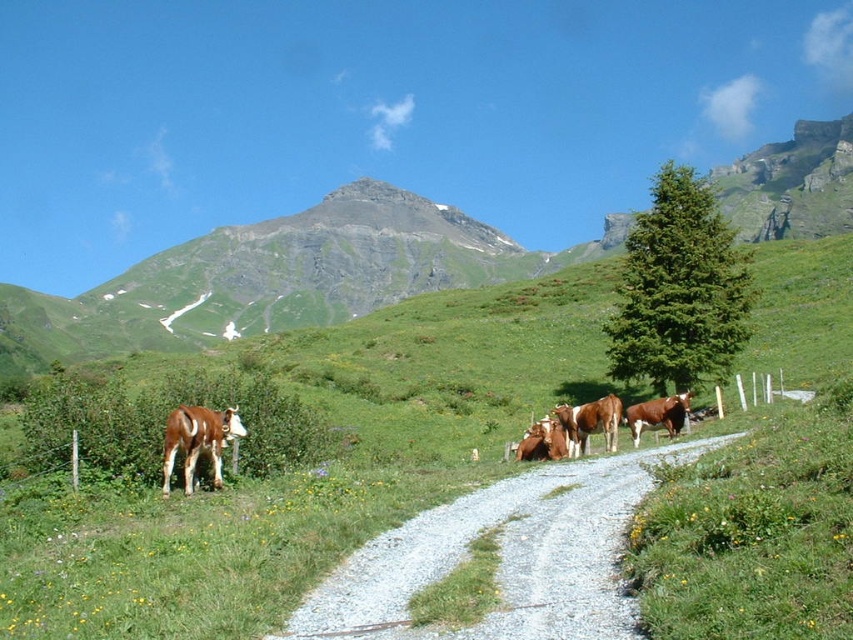
How far apart are gravel road at center and brown glossy cow at lower left?

gravel road at center and brown glossy cow at lower left are 14.34 meters apart.

Is point (434, 513) less distant than point (218, 472)?

That is True.

Is point (368, 580) in front of point (161, 470)?

That is True.

I want to click on gravel road at center, so click(x=502, y=556).

Is gravel road at center bigger than brown glossy cows at center?

No, gravel road at center is not bigger than brown glossy cows at center.

In the scene shown: Who is higher up, gravel road at center or brown glossy cows at center?

brown glossy cows at center is higher up.

Find the location of a particular element. gravel road at center is located at coordinates (502, 556).

Is green grassy mountain at upper center shorter than brown glossy cow at lower left?

No, green grassy mountain at upper center is not shorter than brown glossy cow at lower left.

Is green grassy mountain at upper center thinner than brown glossy cow at lower left?

No.

Is point (62, 307) positioned before point (216, 413)?

No, (62, 307) is behind (216, 413).

This screenshot has height=640, width=853. I want to click on green grassy mountain at upper center, so click(x=279, y=276).